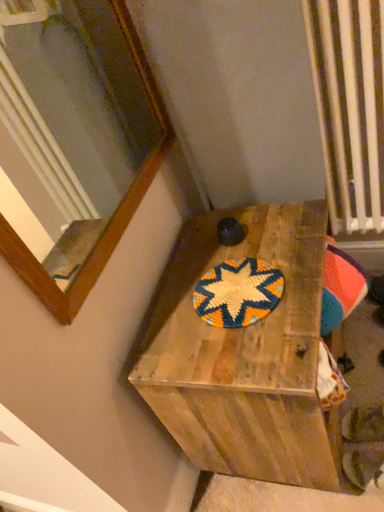
Question: From the image's perspective, is wooden box at center located above or below wooden frame at upper left?

Choices:
 (A) below
 (B) above

Answer: (A)

Question: Considering the relative positions of wooden box at center and wooden frame at upper left in the image provided, is wooden box at center to the left or to the right of wooden frame at upper left?

Choices:
 (A) right
 (B) left

Answer: (A)

Question: Estimate the real-world distances between objects in this image. Which object is farther from the brightly woven mat at center?

Choices:
 (A) wooden box at center
 (B) wooden frame at upper left

Answer: (B)

Question: Estimate the real-world distances between objects in this image. Which object is farther from the wooden frame at upper left?

Choices:
 (A) wooden box at center
 (B) brightly woven mat at center

Answer: (B)